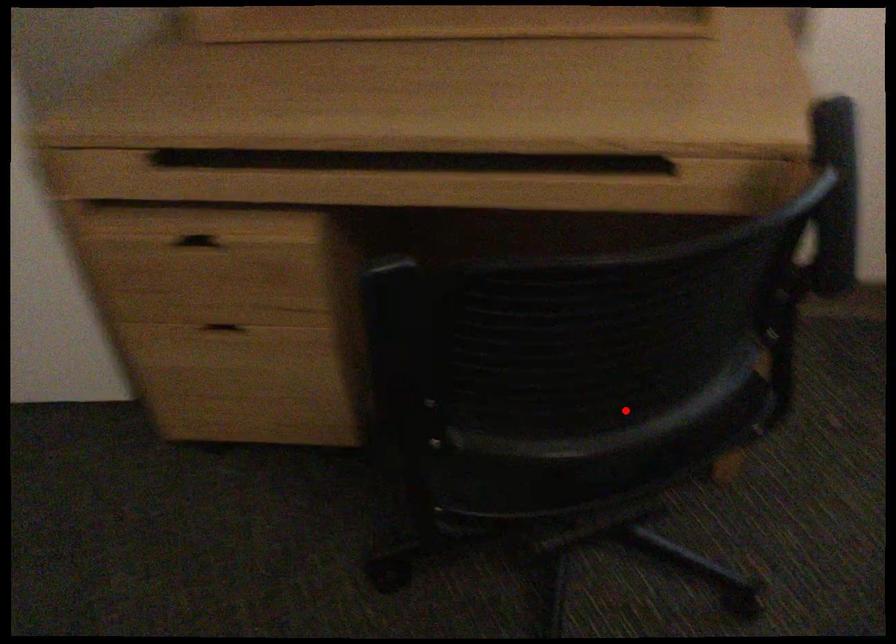
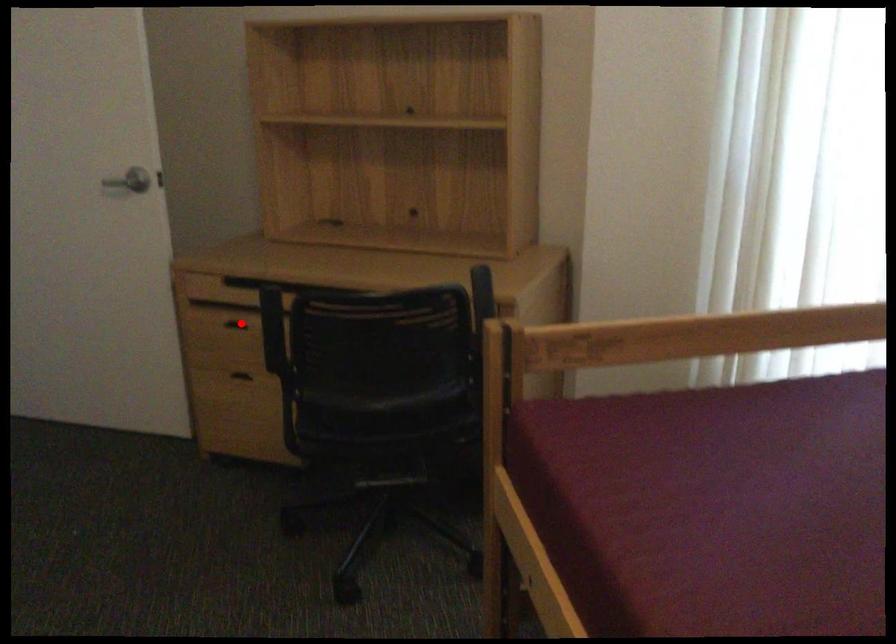
I am providing you with two images of the same scene from different viewpoints. A red point is marked on the first image and another point is marked on the second image. Do the highlighted points in image1 and image2 indicate the same real-world spot?

No